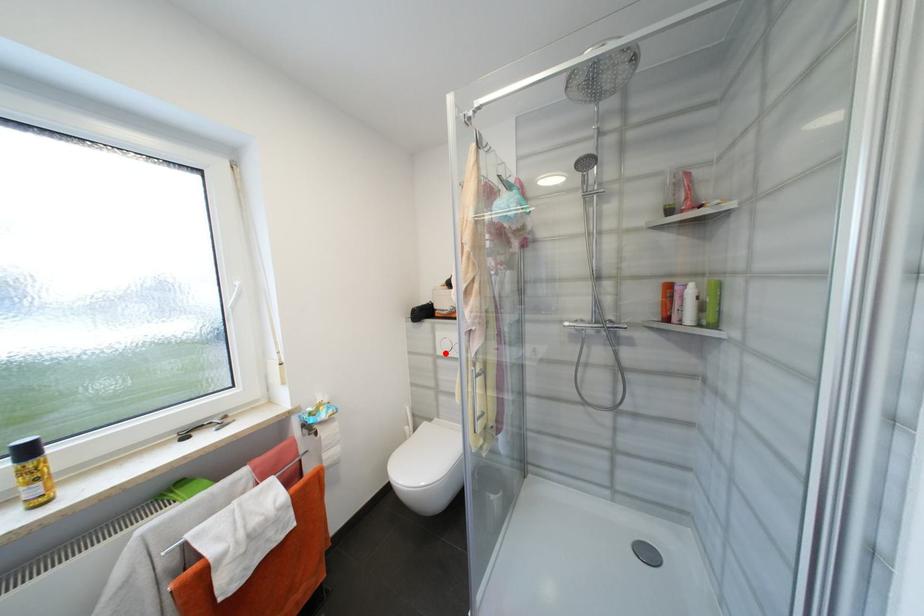
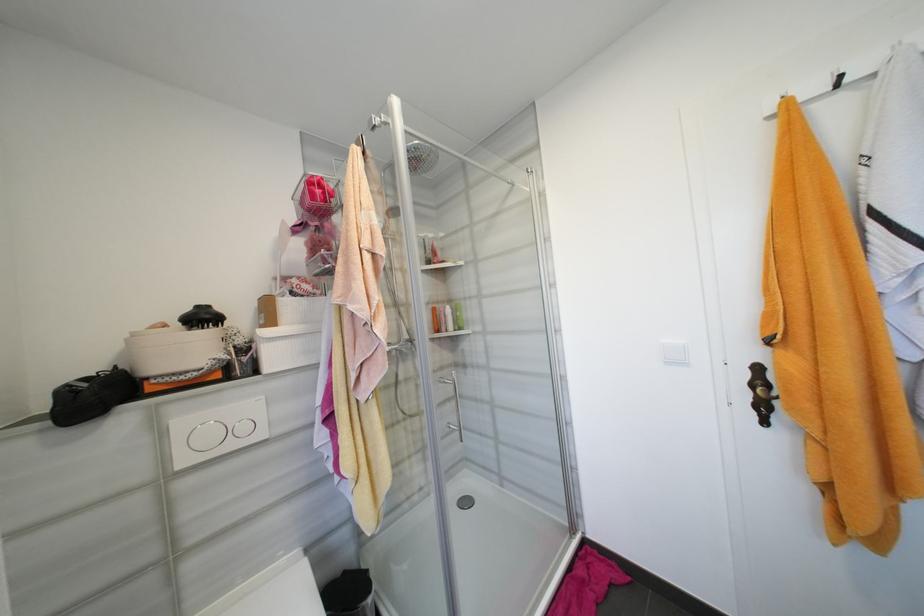
In the second image, find the point that corresponds to the highlighted location in the first image.

(189, 463)